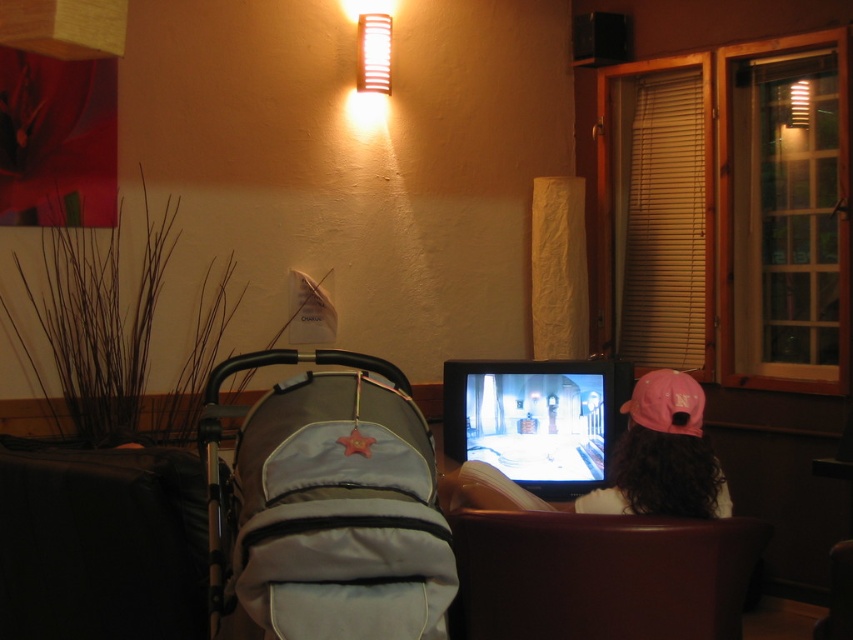
You are sitting in the brown leather armchair at lower center and want to reach the pink fabric baseball cap at right. Can you easily grab it without moving from your seat?

The brown leather armchair at lower center is in front of the pink fabric baseball cap at right, meaning the cap is behind the armchair. Since you are sitting in the armchair, the cap would be out of reach unless you move your seat, so you cannot easily grab it without moving.

You are sitting on the brown leather armchair at lower center and want to reach the pink fabric cap at upper right. Can you easily reach it without moving from the armchair?

The brown leather armchair at lower center is located below the pink fabric cap at upper right, so you can easily reach it without moving from the armchair since it is positioned above you.